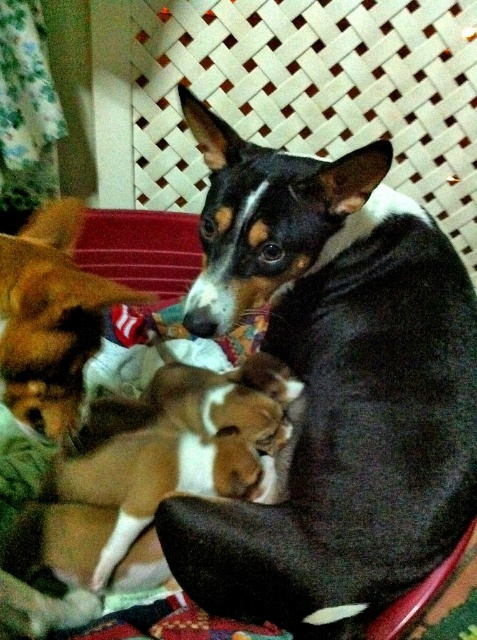
Question: Is black and white fur dog at center bigger than brown soft fur at lower left?

Choices:
 (A) yes
 (B) no

Answer: (A)

Question: Is black and white fur dog at center smaller than brown soft fur at lower left?

Choices:
 (A) yes
 (B) no

Answer: (B)

Question: Which is nearer to the brown soft fur at lower left?

Choices:
 (A) brown and white fur at center
 (B) black and white fur dog at center

Answer: (A)

Question: Is black and white fur dog at center wider than brown soft fur at lower left?

Choices:
 (A) yes
 (B) no

Answer: (A)

Question: Estimate the real-world distances between objects in this image. Which object is closer to the brown and white fur at center?

Choices:
 (A) brown soft fur at lower left
 (B) black and white fur dog at center

Answer: (B)

Question: Which of the following is the farthest from the observer?

Choices:
 (A) brown and white fur at center
 (B) brown soft fur at lower left
 (C) black and white fur dog at center

Answer: (A)